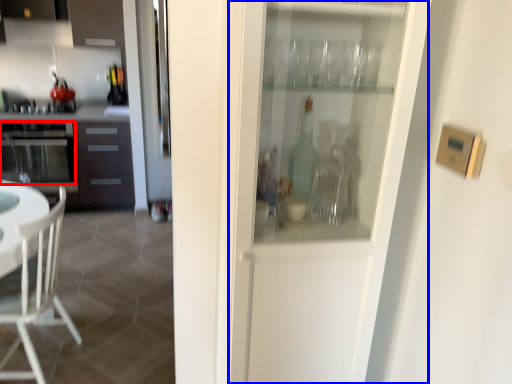
Question: Among these objects, which one is nearest to the camera, oven (highlighted by a red box) or screen door (highlighted by a blue box)?

Choices:
 (A) oven
 (B) screen door

Answer: (B)